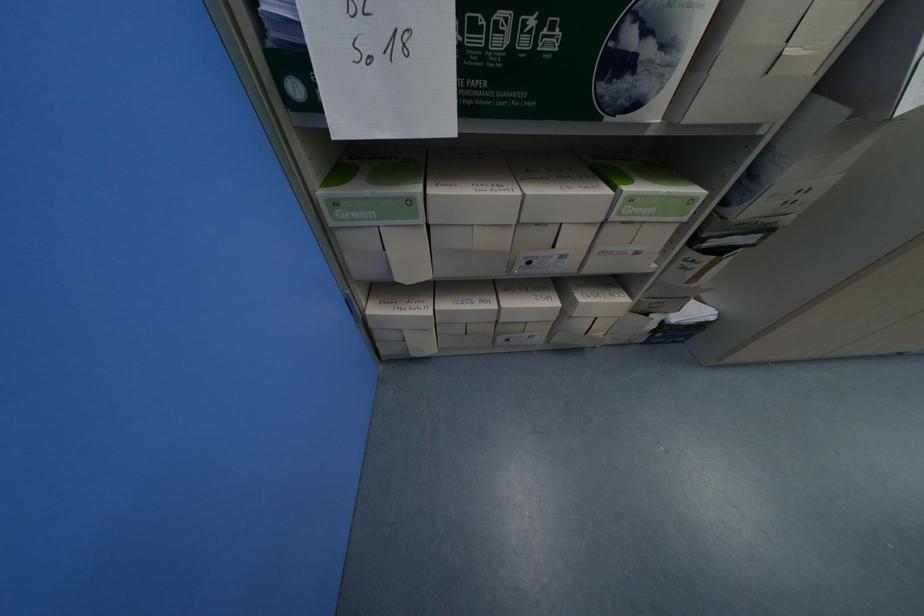
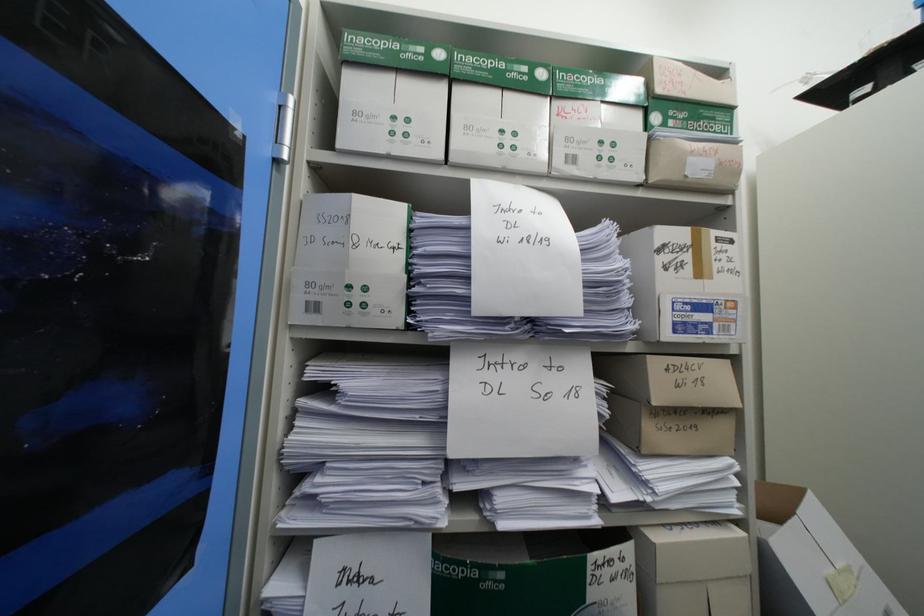
Question: How did the camera likely rotate?

Choices:
 (A) Left
 (B) Right
 (C) Up
 (D) Down

Answer: (C)